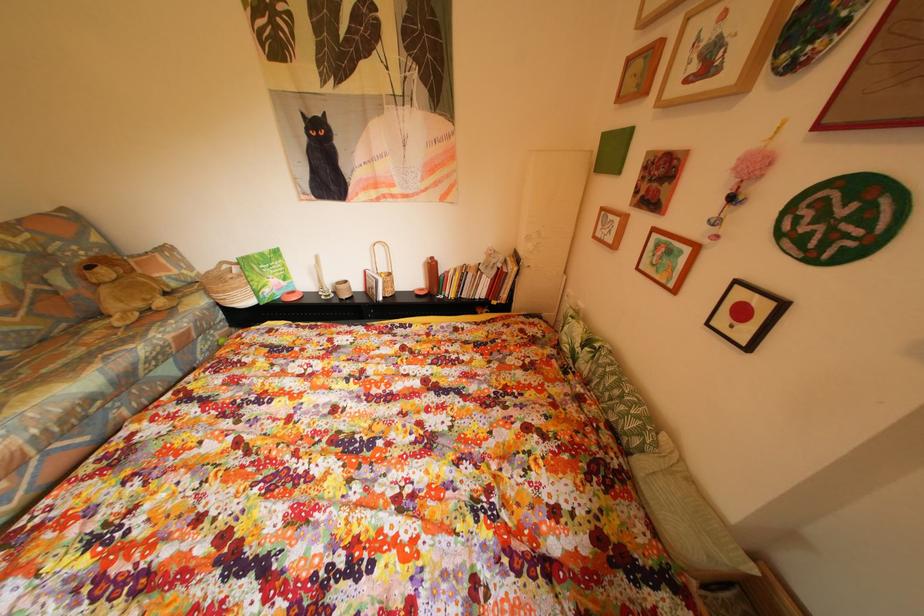
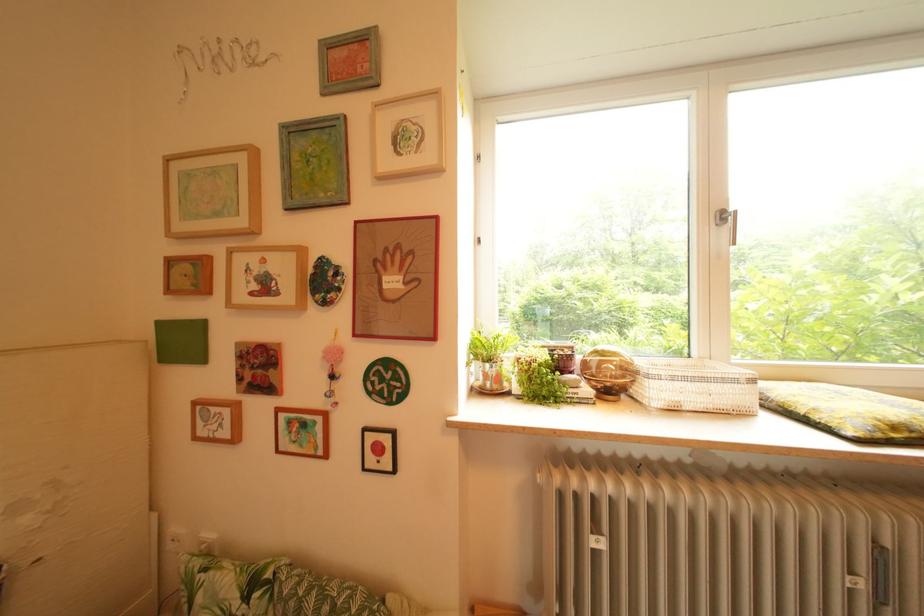
Question: Based on the continuous images, in which direction is the camera rotating? Reply with the corresponding letter.

Choices:
 (A) Left
 (B) Right
 (C) Up
 (D) Down

Answer: (B)